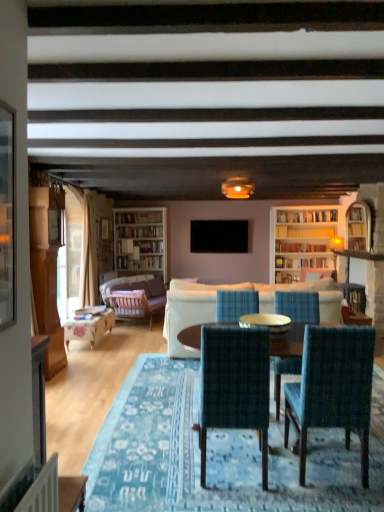
Question: From the image's perspective, is wooden floral-patterned table at left located above clear glass table at center?

Choices:
 (A) no
 (B) yes

Answer: (A)

Question: Can you confirm if wooden floral-patterned table at left is positioned to the right of clear glass table at center?

Choices:
 (A) yes
 (B) no

Answer: (B)

Question: Is wooden floral-patterned table at left positioned far away from clear glass table at center?

Choices:
 (A) no
 (B) yes

Answer: (B)

Question: Is wooden floral-patterned table at left facing towards clear glass table at center?

Choices:
 (A) yes
 (B) no

Answer: (B)

Question: Is wooden floral-patterned table at left completely or partially outside of clear glass table at center?

Choices:
 (A) no
 (B) yes

Answer: (B)

Question: Considering the positions of blue woven chair at center, which is counted as the 3th chair, starting from the front, and wooden round table at center in the image, is blue woven chair at center, which is counted as the 3th chair, starting from the front, wider or thinner than wooden round table at center?

Choices:
 (A) wide
 (B) thin

Answer: (B)

Question: Based on their positions, is blue woven chair at center, which is counted as the 3th chair, starting from the front, located to the left or right of wooden round table at center?

Choices:
 (A) right
 (B) left

Answer: (B)

Question: Considering the positions of point (253, 292) and point (188, 328), is point (253, 292) closer or farther from the camera than point (188, 328)?

Choices:
 (A) closer
 (B) farther

Answer: (A)

Question: From their relative heights in the image, would you say blue woven chair at center, acting as the 1th chair starting from the back, is taller or shorter than wooden round table at center?

Choices:
 (A) short
 (B) tall

Answer: (A)

Question: In terms of width, does blue woven chair at center, acting as the 1th chair starting from the back, look wider or thinner when compared to white fabric couch at center, positioned as the 1th studio couch in front-to-back order?

Choices:
 (A) wide
 (B) thin

Answer: (B)

Question: In terms of height, does blue woven chair at center, which is counted as the 3th chair, starting from the front, look taller or shorter compared to white fabric couch at center, which appears as the 1th studio couch when viewed from the right?

Choices:
 (A) short
 (B) tall

Answer: (A)

Question: Is blue woven chair at center, acting as the 1th chair starting from the back, in front of or behind white fabric couch at center, which appears as the 1th studio couch when viewed from the right, in the image?

Choices:
 (A) behind
 (B) front

Answer: (B)

Question: Does point (226, 305) appear closer or farther from the camera than point (175, 282)?

Choices:
 (A) closer
 (B) farther

Answer: (A)

Question: In the image, is clear glass table at center positioned in front of or behind wooden cabinet at left?

Choices:
 (A) front
 (B) behind

Answer: (A)

Question: From the image's perspective, relative to wooden cabinet at left, is clear glass table at center above or below?

Choices:
 (A) below
 (B) above

Answer: (A)